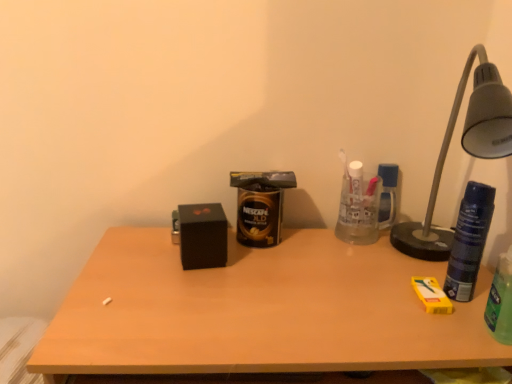
You are a GUI agent. You are given a task and a screenshot of the screen. Output one action in this format:
    pyautogui.click(x=<x>, y=<y>)
    Task: Click on the vacant area that lies between metallic gray lamp at right and black matte box at center
    
    Given the screenshot: What is the action you would take?
    pyautogui.click(x=323, y=273)